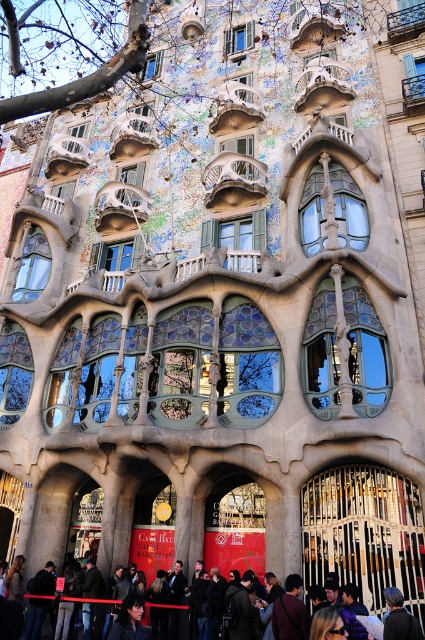
You are a tourist standing in front of Casa Batll? and want to take a photo that includes both the brown textured tree at upper left and the dark brown leather jacket at lower center. Can you fit both in your camera frame if your camera has a maximum field of view of 100 feet?

The brown textured tree at upper left and dark brown leather jacket at lower center are 314.27 feet apart, which exceeds the camera field of view of 100 feet. Therefore, both cannot be captured in a single frame.

You are standing in front of Casa Batll? looking at the brown textured tree at upper left and the dark brown leather jacket at lower center. Which object is positioned more to the left side of the building?

The brown textured tree at upper left is positioned more to the left side of the building than the dark brown leather jacket at lower center.

You are standing in front of the Casa Batll? building and notice a brown textured tree at upper left and a dark brown leather jacket at lower center. Which object is positioned higher on the building?

The brown textured tree at upper left is located above the dark brown leather jacket at lower center, so it is positioned higher on the building.